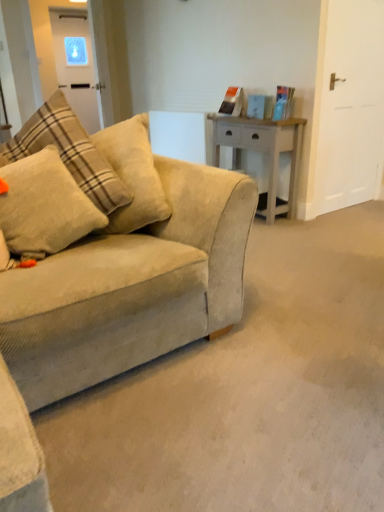
I want to click on free spot in front of white matte door at right, which is the 1th glass door from right to left, so click(350, 227).